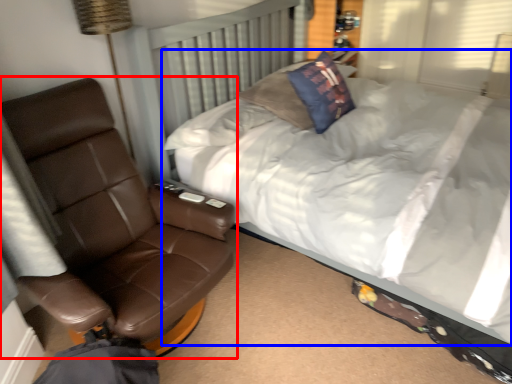
Question: Which of the following is the farthest to the observer, chair (highlighted by a red box) or bed (highlighted by a blue box)?

Choices:
 (A) chair
 (B) bed

Answer: (A)